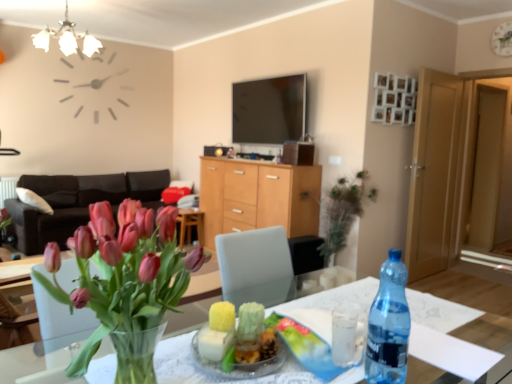
Question: From a real-world perspective, is matte black phone at center positioned over transparent plastic bottle at table right based on gravity?

Choices:
 (A) no
 (B) yes

Answer: (B)

Question: Could you tell me if matte black phone at center is turned towards transparent plastic bottle at table right?

Choices:
 (A) yes
 (B) no

Answer: (A)

Question: Is matte black phone at center in front of transparent plastic bottle at table right?

Choices:
 (A) yes
 (B) no

Answer: (B)

Question: Is matte black phone at center next to transparent plastic bottle at table right and touching it?

Choices:
 (A) yes
 (B) no

Answer: (B)

Question: Does matte black phone at center have a larger size compared to transparent plastic bottle at table right?

Choices:
 (A) no
 (B) yes

Answer: (B)

Question: From the image's perspective, is matte black phone at center beneath transparent plastic bottle at table right?

Choices:
 (A) no
 (B) yes

Answer: (A)

Question: Can we say clear glass vase at center lies outside transparent plastic bottle at table right?

Choices:
 (A) no
 (B) yes

Answer: (B)

Question: Is clear glass vase at center shorter than transparent plastic bottle at table right?

Choices:
 (A) yes
 (B) no

Answer: (B)

Question: Is transparent plastic bottle at table right a part of clear glass vase at center?

Choices:
 (A) no
 (B) yes

Answer: (A)

Question: From the image's perspective, is clear glass vase at center below transparent plastic bottle at table right?

Choices:
 (A) yes
 (B) no

Answer: (A)

Question: Considering the relative sizes of clear glass vase at center and transparent plastic bottle at table right in the image provided, is clear glass vase at center taller than transparent plastic bottle at table right?

Choices:
 (A) yes
 (B) no

Answer: (A)

Question: Would you consider clear glass vase at center to be distant from transparent plastic bottle at table right?

Choices:
 (A) yes
 (B) no

Answer: (A)

Question: From a real-world perspective, is clear glass vase at center on top of light brown wooden door at right, the 2th glass door viewed from the right?

Choices:
 (A) yes
 (B) no

Answer: (B)